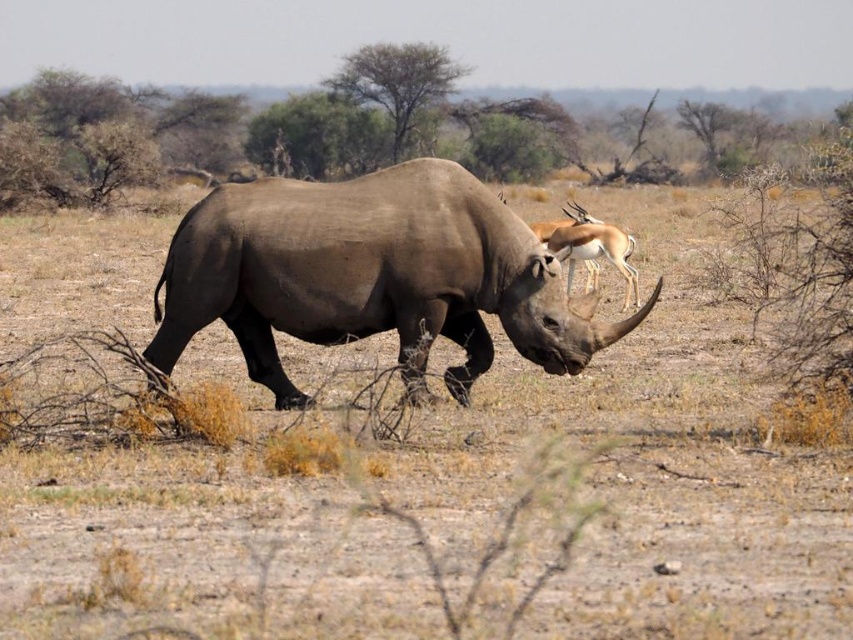
You are a photographer trying to capture the rhinoceros and gazelle in the savanna. You notice two points in the image labeled as point 1 at coordinates point (363, 314) and point 2 at coordinates point (608, 232). Which point is closer to your camera lens?

Point 1 at coordinates point (363, 314) is closer to the camera lens than point 2 at coordinates point (608, 232).

You are a photographer trying to capture both the gray matte rhinoceros at center and the smooth brown antelope at upper right in a single frame. Based on their positions, which animal would appear closer to the bottom edge of your photo?

The gray matte rhinoceros at center is positioned below the smooth brown antelope at upper right, so it would appear closer to the bottom edge of the photo.